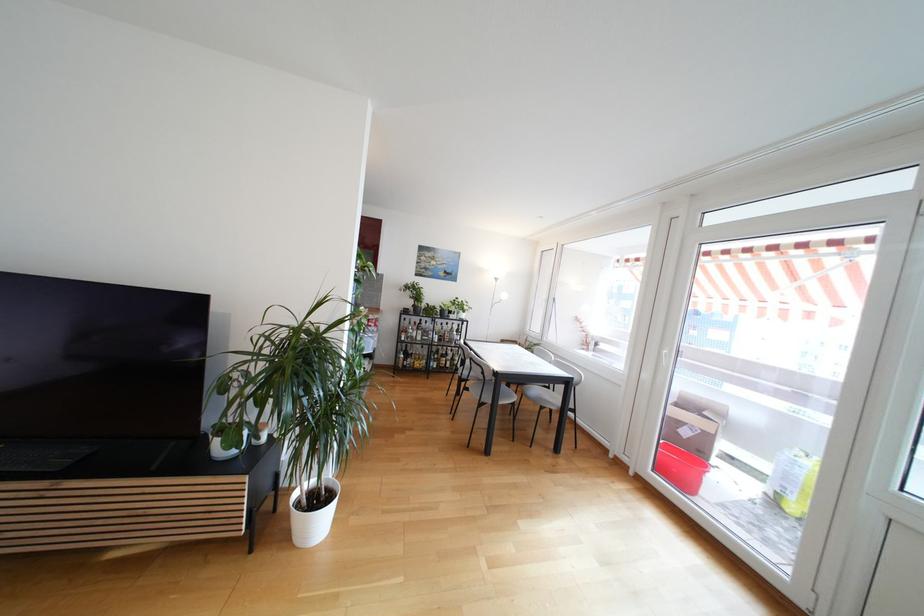
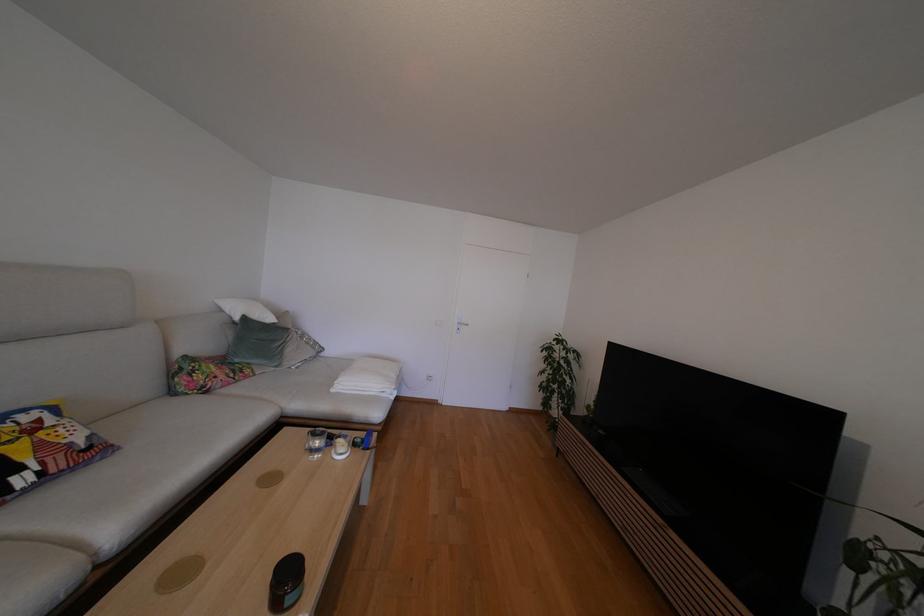
Question: The first image is from the beginning of the video and the second image is from the end. How did the camera likely rotate when shooting the video?

Choices:
 (A) Left
 (B) Right
 (C) Up
 (D) Down

Answer: (A)